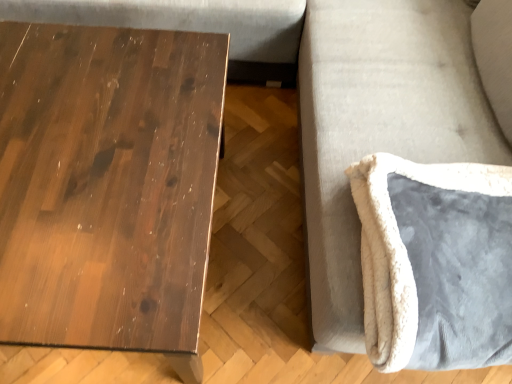
Question: From a real-world perspective, is dark wood table at left positioned above or below velvet gray swivel chair at right?

Choices:
 (A) below
 (B) above

Answer: (A)

Question: In the image, is dark wood table at left positioned in front of or behind velvet gray swivel chair at right?

Choices:
 (A) front
 (B) behind

Answer: (B)

Question: Which is nearer to the dark wood table at left?

Choices:
 (A) velvet gray swivel chair at right
 (B) white plush cushion at lower right

Answer: (B)

Question: Estimate the real-world distances between objects in this image. Which object is closer to the white plush cushion at lower right?

Choices:
 (A) velvet gray swivel chair at right
 (B) dark wood table at left

Answer: (A)